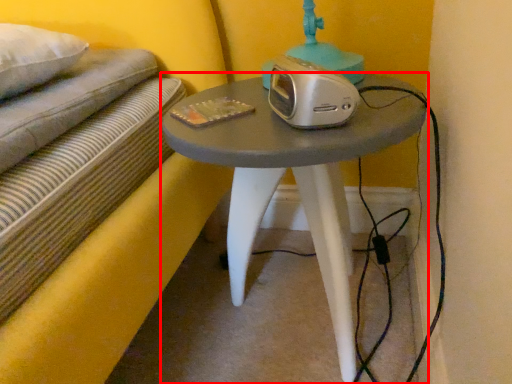
Question: From the image's perspective, where is table (annotated by the red box) located relative to stereo?

Choices:
 (A) below
 (B) above

Answer: (A)